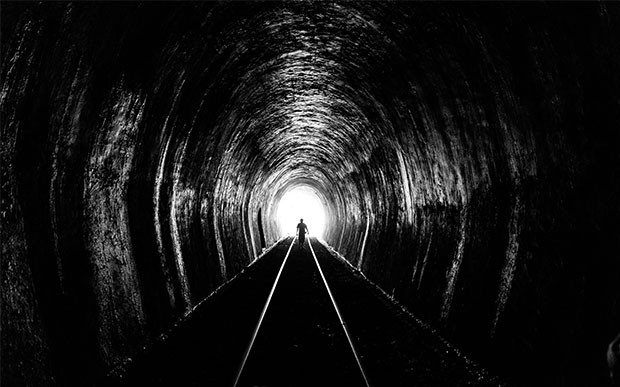
Locate an element on the screen. The width and height of the screenshot is (620, 387). light is located at coordinates (309, 206).